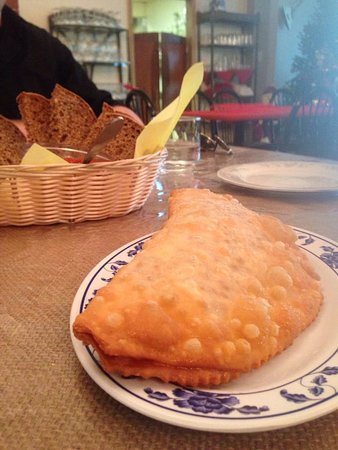
At what (x,y) coordinates should I click in order to perform the action: click on table. Please return your answer as a coordinate pair (x, y). This screenshot has height=450, width=338. Looking at the image, I should click on (42, 311), (240, 108).